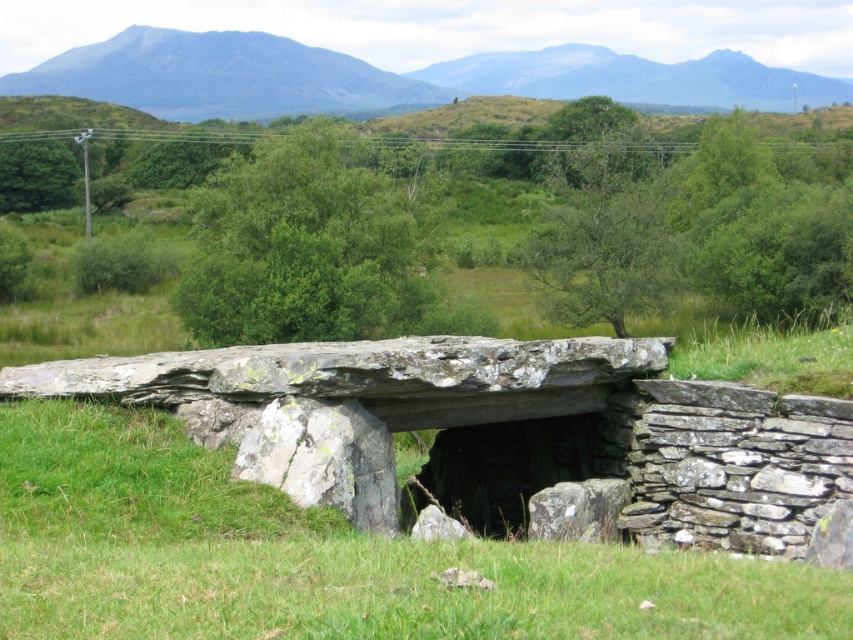
You are standing in the middle of the rural landscape and want to walk towards the gray rock mountain at upper center. Which direction should you move relative to the green grass at center?

You should move to the right relative to the green grass at center because the gray rock mountain at upper center is to the right of the green grass at center.

You are standing at the edge of the rural landscape and want to walk towards the green grass at center. Based on the coordinates provided, in which general direction should you head?

The green grass at center is located at coordinates point 0.872 on the x axis and 0.379 on the y axis. Since the x coordinate is closer to 1, you should head towards the right direction to reach it.

You are standing at the ancient stone structure and want to walk towards the point that is closer to you. Which point should you head towards, point (206,92) or point (653,77)?

Point (206,92) is in front of point (653,77), so you should head towards point (206,92) since it is closer to your current position.